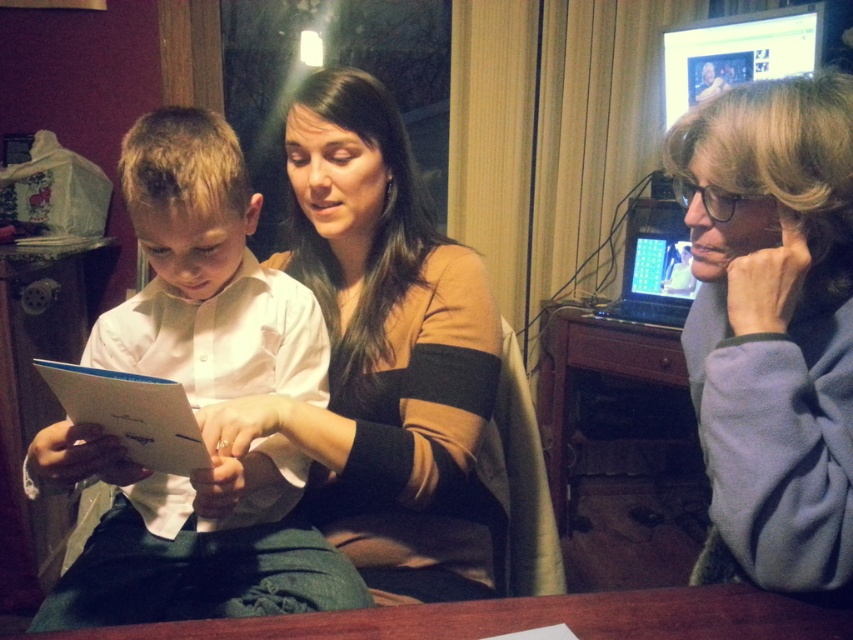
Question: Which object is the farthest from the gray fleece jacket at right?

Choices:
 (A) matte brown sweater at center
 (B) wooden table at right
 (C) shiny plastic monitor at upper right
 (D) white smooth shirt at center

Answer: (C)

Question: Can you confirm if gray fleece jacket at right is wider than shiny plastic monitor at upper right?

Choices:
 (A) no
 (B) yes

Answer: (A)

Question: Among these objects, which one is farthest from the camera?

Choices:
 (A) gray fleece jacket at right
 (B) white smooth shirt at center
 (C) wooden table at right

Answer: (C)

Question: Which point is farther to the camera?

Choices:
 (A) shiny plastic monitor at upper right
 (B) matte brown sweater at center

Answer: (A)

Question: Can you confirm if wooden table at right is wider than shiny plastic monitor at upper right?

Choices:
 (A) no
 (B) yes

Answer: (B)

Question: Is gray fleece jacket at right wider than shiny plastic monitor at upper right?

Choices:
 (A) yes
 (B) no

Answer: (B)